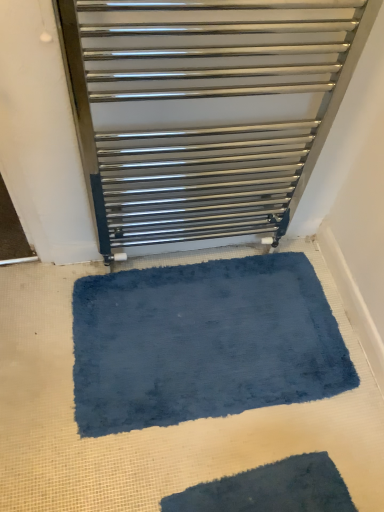
Image resolution: width=384 pixels, height=512 pixels. Find the location of `blank space situated above dark blue shaggy bath mat at lower center, which appears as the second bath mat when viewed from the top (from a real-world perspective)`. blank space situated above dark blue shaggy bath mat at lower center, which appears as the second bath mat when viewed from the top (from a real-world perspective) is located at coordinates (278, 485).